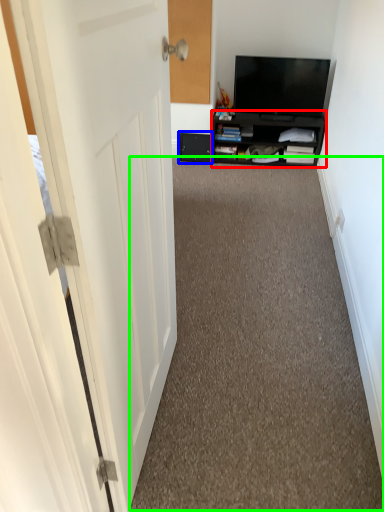
Question: Considering the real-world distances, which object is farthest from cabinetry (highlighted by a red box)? drawer (highlighted by a blue box) or corridor (highlighted by a green box)?

Choices:
 (A) drawer
 (B) corridor

Answer: (B)